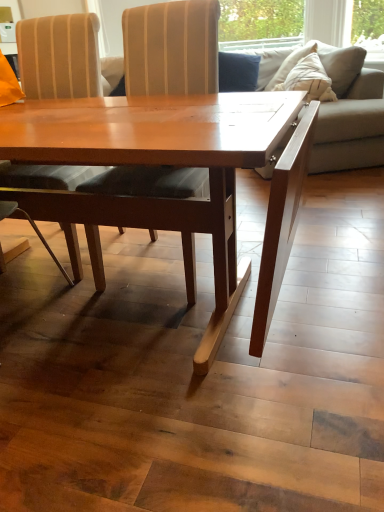
Question: Considering the relative sizes of beige fabric couch at right and velvet blue pillow at upper center in the image provided, is beige fabric couch at right smaller than velvet blue pillow at upper center?

Choices:
 (A) yes
 (B) no

Answer: (B)

Question: Would you say beige fabric couch at right contains velvet blue pillow at upper center?

Choices:
 (A) no
 (B) yes

Answer: (B)

Question: Is beige fabric couch at right aimed at velvet blue pillow at upper center?

Choices:
 (A) no
 (B) yes

Answer: (B)

Question: Is beige fabric couch at right looking in the opposite direction of velvet blue pillow at upper center?

Choices:
 (A) yes
 (B) no

Answer: (B)

Question: Are beige fabric couch at right and velvet blue pillow at upper center located far from each other?

Choices:
 (A) yes
 (B) no

Answer: (B)

Question: Can you confirm if beige fabric couch at right is positioned to the left of velvet blue pillow at upper center?

Choices:
 (A) no
 (B) yes

Answer: (A)

Question: Is wooden striped chair at center, arranged as the 1th chair when viewed from the right, looking in the opposite direction of matte wood chair at center, which appears as the first chair when viewed from the left?

Choices:
 (A) no
 (B) yes

Answer: (A)

Question: Does wooden striped chair at center, arranged as the 1th chair when viewed from the right, have a greater height compared to matte wood chair at center, which appears as the first chair when viewed from the left?

Choices:
 (A) yes
 (B) no

Answer: (B)

Question: From a real-world perspective, is wooden striped chair at center, arranged as the 1th chair when viewed from the right, physically below matte wood chair at center, which ranks as the 2th chair in right-to-left order?

Choices:
 (A) no
 (B) yes

Answer: (B)

Question: Considering the relative sizes of wooden striped chair at center, arranged as the 1th chair when viewed from the right, and matte wood chair at center, which ranks as the 2th chair in right-to-left order, in the image provided, is wooden striped chair at center, arranged as the 1th chair when viewed from the right, wider than matte wood chair at center, which ranks as the 2th chair in right-to-left order,?

Choices:
 (A) yes
 (B) no

Answer: (A)

Question: From a real-world perspective, is wooden striped chair at center, arranged as the 1th chair when viewed from the right, on top of matte wood chair at center, which appears as the first chair when viewed from the left?

Choices:
 (A) yes
 (B) no

Answer: (B)

Question: Could you tell me if wooden striped chair at center, which appears as the 2th chair when viewed from the left, is facing matte wood chair at center, which ranks as the 2th chair in right-to-left order?

Choices:
 (A) yes
 (B) no

Answer: (B)

Question: Considering the relative positions of velvet blue pillow at upper center and beige fabric couch at right in the image provided, is velvet blue pillow at upper center to the right of beige fabric couch at right from the viewer's perspective?

Choices:
 (A) yes
 (B) no

Answer: (B)